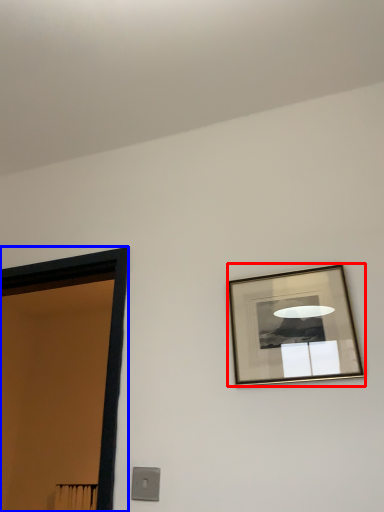
Question: Which object appears farthest to the camera in this image, picture frame (highlighted by a red box) or door (highlighted by a blue box)?

Choices:
 (A) picture frame
 (B) door

Answer: (B)